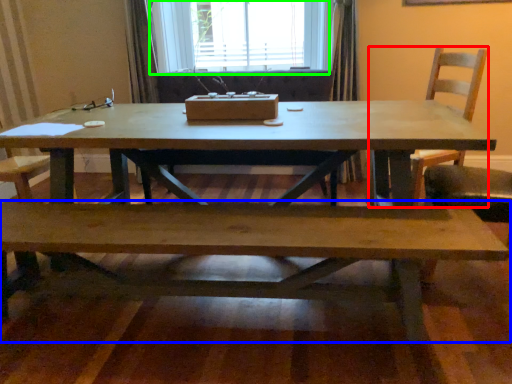
Question: Which object is positioned farthest from chair (highlighted by a red box)? Select from bench (highlighted by a blue box) and window (highlighted by a green box).

Choices:
 (A) bench
 (B) window

Answer: (B)